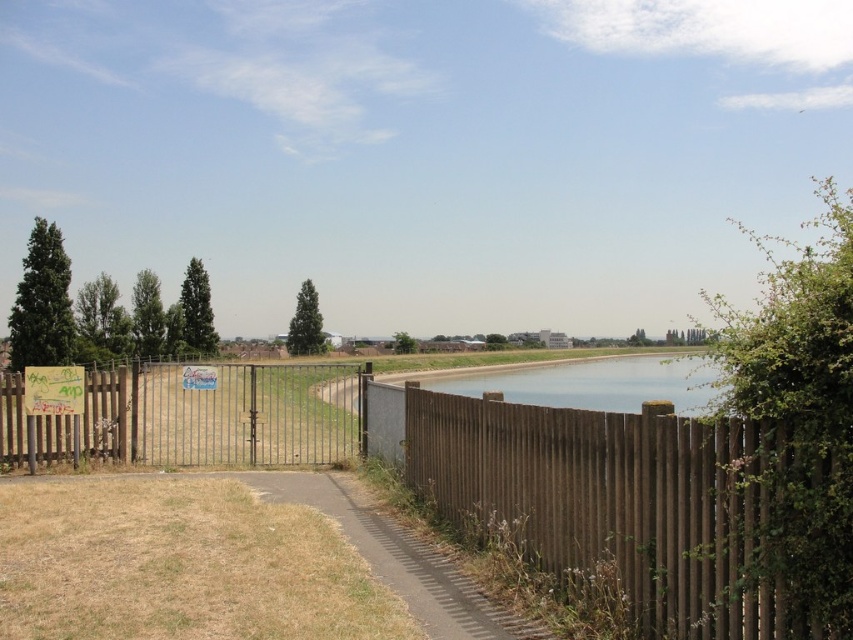
You are a painter who wants to paint the brown wooden fence at left and the clear water at center. If you use the same brush size for both, which object will require more strokes to cover its entire width?

The clear water at center requires more strokes to cover its entire width because the brown wooden fence at left is narrower than the clear water at center according to the description.

You are standing at the center of the pathway in the scene. Which direction should you walk to reach the brown wooden fence at right?

Since the brown wooden fence at right is located at coordinates approximately 0.794 on the x and 0.766 on the y axis, you should walk towards the right and slightly forward to reach it.

You are standing at the entrance of the path and want to go to the water. Which object is closer to you, the brown wooden fence at left or the brown textured path at lower center?

The brown textured path at lower center is closer to you because it is at the lower center, while the brown wooden fence at left is positioned under it, meaning it is further away.